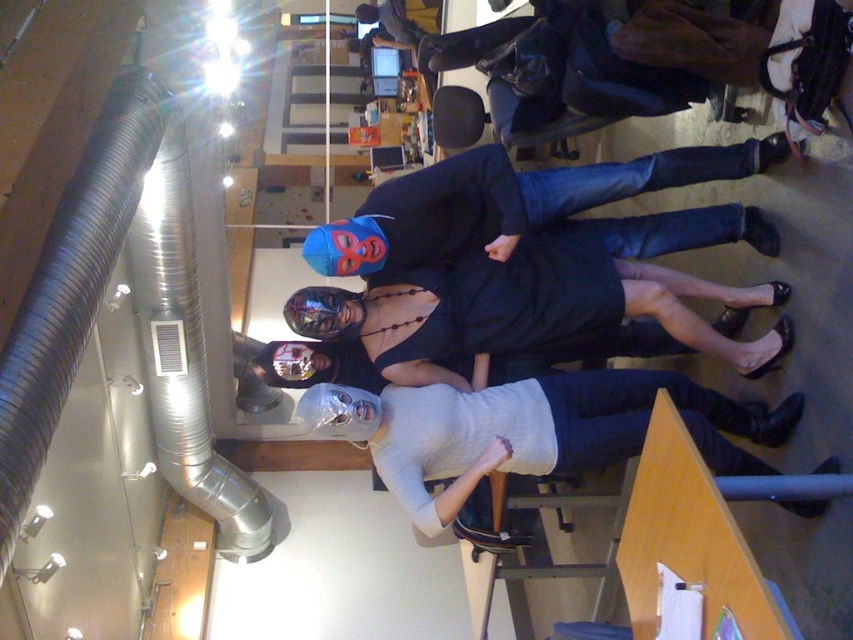
Who is positioned more to the left, white matte mask at center or matte black mask at center?

matte black mask at center is more to the left.

Who is higher up, white matte mask at center or matte black mask at center?

matte black mask at center is above.

Does point (567, 435) lie behind point (592, 332)?

No, (567, 435) is closer to viewer.

I want to click on white matte mask at center, so click(x=531, y=429).